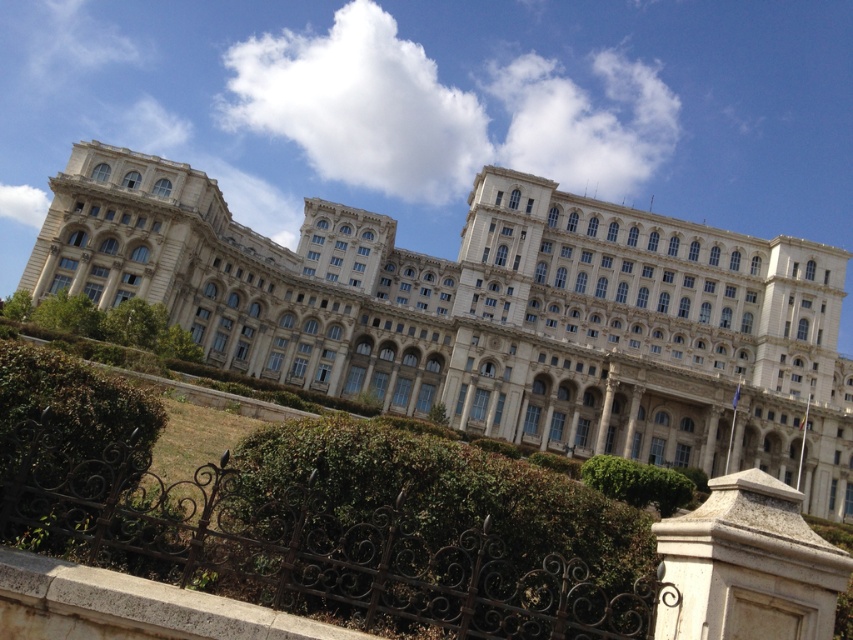
Question: In this image, where is white stone building at center located relative to green leafy hedge at lower center?

Choices:
 (A) left
 (B) right

Answer: (B)

Question: Which object appears farthest from the camera in this image?

Choices:
 (A) green leafy hedge at center
 (B) green leafy hedge at lower center
 (C) green leafy hedge at lower left
 (D) white stone building at center

Answer: (D)

Question: Is white stone building at center above green leafy hedge at lower left?

Choices:
 (A) no
 (B) yes

Answer: (B)

Question: Which point appears farthest from the camera in this image?

Choices:
 (A) (650, 500)
 (B) (347, 337)

Answer: (B)

Question: Which of the following is the closest to the observer?

Choices:
 (A) (537, 499)
 (B) (567, 273)
 (C) (62, 444)
 (D) (637, 465)

Answer: (C)

Question: Is green leafy hedge at lower center bigger than green leafy hedge at lower left?

Choices:
 (A) no
 (B) yes

Answer: (B)